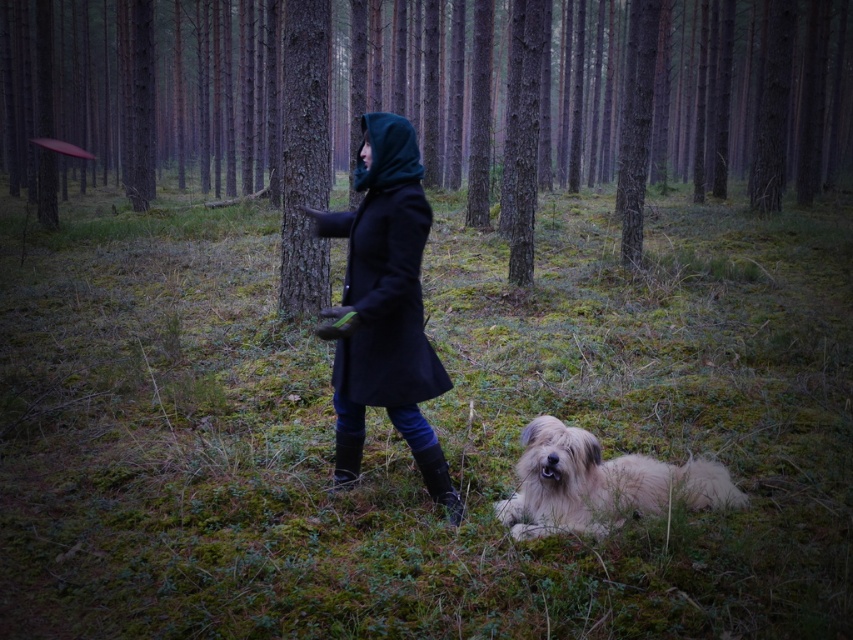
You are a hiker in the forest and see the brown rough tree at center and the black matte coat at center. Which object is located to the left of the other?

The brown rough tree at center is positioned on the left side of black matte coat at center.

You are standing at the point marked as point [389,364] in the forest scene. If you want to throw a red frisbee to someone who is exactly 3.52 meters away from you, can you reach them with your throw?

Yes, because the distance between point [389,364] and the viewer is exactly 3.52 meters, so throwing the red frisbee to that distance is possible.